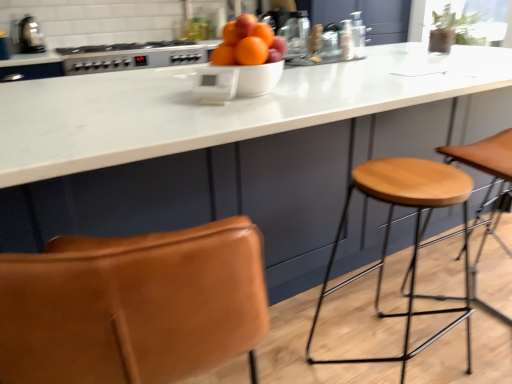
What do you see at coordinates (215, 85) in the screenshot? I see `white plastic thermostat at center, the 1th appliance in the bottom-to-top sequence` at bounding box center [215, 85].

This screenshot has height=384, width=512. Describe the element at coordinates (248, 43) in the screenshot. I see `matte white bowl at center` at that location.

Locate an element on the screen. light brown wood stool at right is located at coordinates (487, 194).

This screenshot has width=512, height=384. I want to click on wooden seat at right, so pyautogui.click(x=415, y=235).

Is satin silver gas stove at upper center a part of matte white bowl at center?

No.

From the image's perspective, is matte white bowl at center below satin silver gas stove at upper center?

Indeed, from the image's perspective, matte white bowl at center is shown beneath satin silver gas stove at upper center.

Is matte white bowl at center taller than satin silver gas stove at upper center?

Incorrect, the height of matte white bowl at center is not larger of that of satin silver gas stove at upper center.

Considering the relative positions of matte white bowl at center and satin silver gas stove at upper center in the image provided, is matte white bowl at center to the left of satin silver gas stove at upper center from the viewer's perspective?

No, matte white bowl at center is not to the left of satin silver gas stove at upper center.

Which is in front, white plastic thermostat at center, which is counted as the 1th appliance, starting from the right, or light brown wood stool at right?

Positioned in front is light brown wood stool at right.

From a real-world perspective, is white plastic thermostat at center, placed as the second appliance when sorted from top to bottom, on top of light brown wood stool at right?

Indeed, from a real-world perspective, white plastic thermostat at center, placed as the second appliance when sorted from top to bottom, stands above light brown wood stool at right.

Is light brown wood stool at right at the back of white plastic thermostat at center, the 1th appliance in the bottom-to-top sequence?

No, white plastic thermostat at center, the 1th appliance in the bottom-to-top sequence,'s orientation is not away from light brown wood stool at right.

Is light brown wood stool at right inside white plastic thermostat at center, which is counted as the 1th appliance, starting from the right?

Actually, light brown wood stool at right is outside white plastic thermostat at center, which is counted as the 1th appliance, starting from the right.

Is matte white bowl at center positioned before light brown wood stool at right?

No, it is behind light brown wood stool at right.

From a real-world perspective, between matte white bowl at center and light brown wood stool at right, who is vertically higher?

matte white bowl at center, from a real-world perspective.

Find the location of a particular element. step stool on the right of the matte white bowl at center is located at coordinates (487, 194).

Who is taller, matte white bowl at center or light brown wood stool at right?

With more height is light brown wood stool at right.

Would you say satin silver gas stove at upper center is outside white plastic thermostat at center, placed as the second appliance when sorted from top to bottom?

satin silver gas stove at upper center is positioned outside white plastic thermostat at center, placed as the second appliance when sorted from top to bottom.

Between satin silver gas stove at upper center and white plastic thermostat at center, placed as the second appliance when sorted from top to bottom, which one has larger size?

satin silver gas stove at upper center.

From the image's perspective, which one is positioned higher, satin silver gas stove at upper center or white plastic thermostat at center, placed as the second appliance when sorted from top to bottom?

From the image's view, satin silver gas stove at upper center is above.

Is point (193, 63) behind point (215, 95)?

Yes, it is behind point (215, 95).

From a real-world perspective, between white plastic thermostat at center, the 1th appliance in the bottom-to-top sequence, and wooden seat at right, who is vertically lower?

wooden seat at right, from a real-world perspective.

This screenshot has height=384, width=512. I want to click on the 1st appliance positioned above the wooden seat at right (from a real-world perspective), so click(215, 85).

Does white plastic thermostat at center, placed as the second appliance when sorted from top to bottom, have a greater height compared to wooden seat at right?

In fact, white plastic thermostat at center, placed as the second appliance when sorted from top to bottom, may be shorter than wooden seat at right.

Measure the distance between white plastic thermostat at center, the second appliance in the back-to-front sequence, and wooden seat at right.

white plastic thermostat at center, the second appliance in the back-to-front sequence, is 35.65 inches from wooden seat at right.

Relative to wooden seat at right, is matte white bowl at center in front or behind?

Visually, matte white bowl at center is located behind wooden seat at right.

From the picture: Does matte white bowl at center appear on the left side of wooden seat at right?

Yes, matte white bowl at center is to the left of wooden seat at right.

From the image's perspective, between matte white bowl at center and wooden seat at right, which one is located above?

matte white bowl at center is shown above in the image.

Is matte white bowl at center far from wooden seat at right?

No, matte white bowl at center is not far from wooden seat at right.

Can you confirm if light brown wood stool at right is smaller than satin silver gas stove at upper center?

Actually, light brown wood stool at right might be larger than satin silver gas stove at upper center.

This screenshot has height=384, width=512. Identify the location of step stool on the right of satin silver gas stove at upper center. (487, 194).

Is point (451, 153) less distant than point (112, 52)?

Yes.

From the picture: What's the angular difference between light brown wood stool at right and satin silver gas stove at upper center's facing directions?

The facing directions of light brown wood stool at right and satin silver gas stove at upper center are 176 degrees apart.

At what (x,y) coordinates should I click in order to perform the action: click on gas stove on the left of matte white bowl at center. Please return your answer as a coordinate pair (x, y). Looking at the image, I should click on (133, 56).

This screenshot has width=512, height=384. Identify the location of the 1st appliance directly above the light brown wood stool at right (from a real-world perspective). (215, 85).

Estimate the real-world distances between objects in this image. Which object is closer to white glossy bowl at center, metallic silver toaster at upper left, arranged as the 2th appliance when viewed from the front, or light brown wood stool at right?

light brown wood stool at right is closer to white glossy bowl at center.

When comparing their distances from satin silver gas stove at upper center, does wooden seat at right or white glossy bowl at center seem closer?

A: The object closer to satin silver gas stove at upper center is white glossy bowl at center.

Estimate the real-world distances between objects in this image. Which object is closer to matte white bowl at center, metallic silver toaster at upper left, which is counted as the first appliance, starting from the left, or wooden seat at right?

wooden seat at right is closer to matte white bowl at center.

From the image, which object appears to be farther from white plastic thermostat at center, placed as the second appliance when sorted from top to bottom, wooden seat at right or light brown wood stool at right?

The object further to white plastic thermostat at center, placed as the second appliance when sorted from top to bottom, is light brown wood stool at right.

Estimate the real-world distances between objects in this image. Which object is closer to satin silver gas stove at upper center, white plastic thermostat at center, placed as the second appliance when sorted from left to right, or metallic silver toaster at upper left, which is counted as the first appliance, starting from the left?

Based on the image, metallic silver toaster at upper left, which is counted as the first appliance, starting from the left, appears to be nearer to satin silver gas stove at upper center.

Considering their positions, is light brown wood stool at right positioned further to wooden seat at right than white glossy bowl at center?

white glossy bowl at center is further to wooden seat at right.

Based on their spatial positions, is white glossy bowl at center or wooden seat at right closer to satin silver gas stove at upper center?

white glossy bowl at center is closer to satin silver gas stove at upper center.

When comparing their distances from matte white bowl at center, does white glossy bowl at center or light brown wood stool at right seem closer?

Based on the image, white glossy bowl at center appears to be nearer to matte white bowl at center.

I want to click on orange between satin silver gas stove at upper center and light brown wood stool at right in the horizontal direction, so click(x=248, y=43).

Find the location of a particular element. This screenshot has height=384, width=512. bowl positioned between wooden seat at right and satin silver gas stove at upper center from near to far is located at coordinates (258, 79).

Locate an element on the screen. This screenshot has width=512, height=384. orange located between metallic silver toaster at upper left, which is counted as the first appliance, starting from the left, and wooden seat at right in the left-right direction is located at coordinates (248, 43).

Where is `stool between white glossy bowl at center and light brown wood stool at right`? This screenshot has width=512, height=384. stool between white glossy bowl at center and light brown wood stool at right is located at coordinates (415, 235).